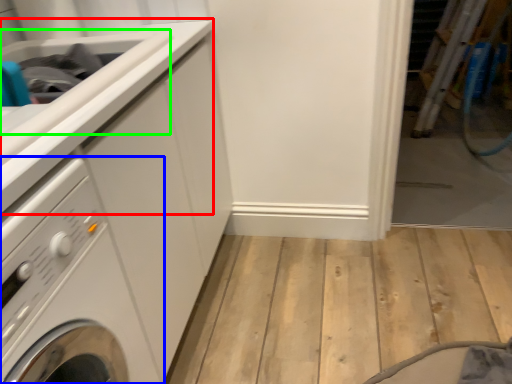
Question: Which object is the closest to the counter top (highlighted by a red box)? Choose among these: washing machine (highlighted by a blue box) or sink (highlighted by a green box).

Choices:
 (A) washing machine
 (B) sink

Answer: (B)